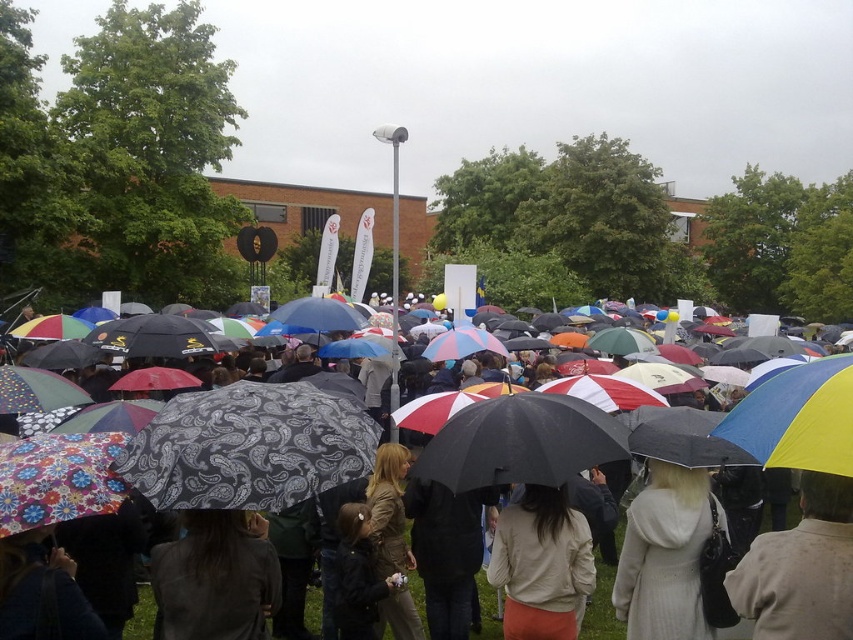
Is the position of white wool coat at center more distant than that of beige fabric jacket at center?

Yes, it is.

Who is positioned more to the left, white wool coat at center or beige fabric jacket at center?

beige fabric jacket at center

Who is more forward, (627, 620) or (509, 548)?

Point (509, 548) is in front.

This screenshot has height=640, width=853. Identify the location of white wool coat at center. (665, 556).

Can you confirm if light beige sweater at lower right is bigger than white wool coat at center?

Actually, light beige sweater at lower right might be smaller than white wool coat at center.

Measure the distance from light beige sweater at lower right to white wool coat at center.

The distance of light beige sweater at lower right from white wool coat at center is 4.22 feet.

Between point (834, 564) and point (674, 552), which one is positioned behind?

Positioned behind is point (674, 552).

Where is `light beige sweater at lower right`? Image resolution: width=853 pixels, height=640 pixels. light beige sweater at lower right is located at coordinates (801, 568).

Is light beige sweater at lower right taller than dark gray paisley-patterned umbrella at center?

Yes.

Can you confirm if light beige sweater at lower right is positioned to the right of dark gray paisley-patterned umbrella at center?

Correct, you'll find light beige sweater at lower right to the right of dark gray paisley-patterned umbrella at center.

Who is more forward, (834,609) or (198,550)?

Point (834,609) is more forward.

This screenshot has width=853, height=640. I want to click on light beige sweater at lower right, so click(801, 568).